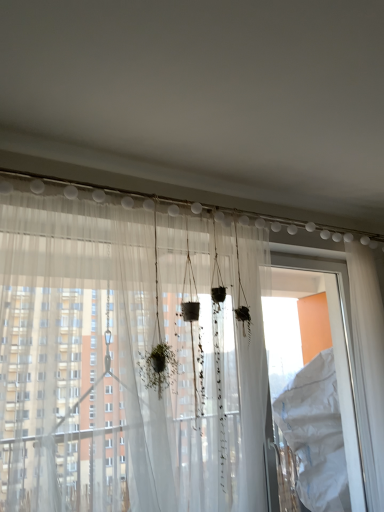
Question: From the image's perspective, is white plastic screen door at right located above or below translucent fabric curtain at center?

Choices:
 (A) above
 (B) below

Answer: (B)

Question: Visually, is white plastic screen door at right positioned to the left or to the right of translucent fabric curtain at center?

Choices:
 (A) right
 (B) left

Answer: (A)

Question: Which object is positioned farthest from the translucent fabric curtain at center?

Choices:
 (A) translucent fabric at center
 (B) white plastic screen door at right

Answer: (B)

Question: Which object is positioned farthest from the white plastic screen door at right?

Choices:
 (A) translucent fabric curtain at center
 (B) translucent fabric at center

Answer: (B)